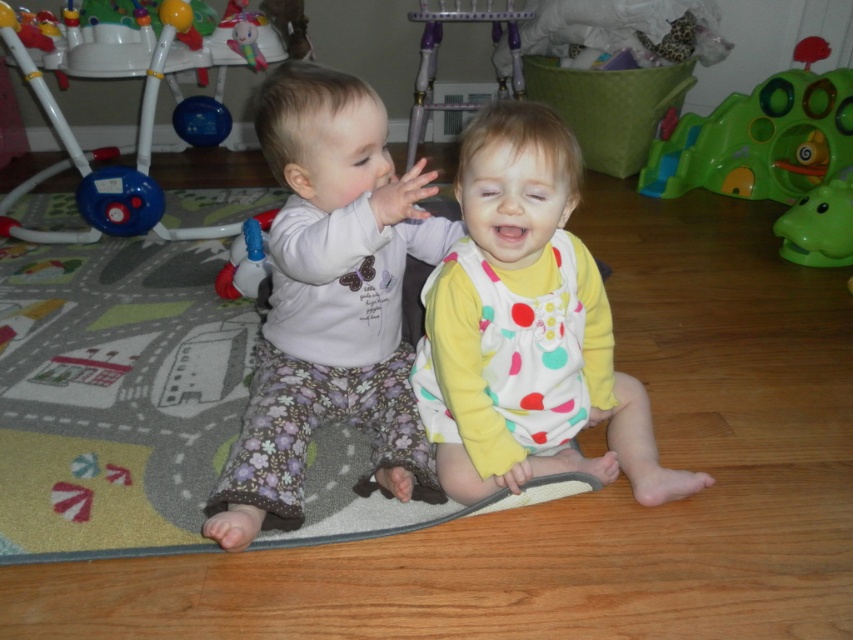
You are a parent trying to locate two points on the play mat where you placed toys. The first point is at coordinates point (347, 296) and the second is at point (83, 198). From your perspective standing at the edge of the play mat, which point is closer to you?

Point (83, 198) is closer to you because it is behind point (347, 296), meaning the latter is further away.

You are a parent trying to decide whether to place a new toy on the play mat. The toy is 1 meter tall. Based on the image, can the polka dot fabric dress at center and the green plastic play structure at right fit the toy without it falling over?

The polka dot fabric dress at center is not as tall as the green plastic play structure at right. Since the toy is 1 meter tall, it might be too tall for both objects to support it, but the green plastic play structure at right, being taller, could potentially provide better stability. However, without knowing the exact height of the play structure, it is uncertain if it can support the toy safely.